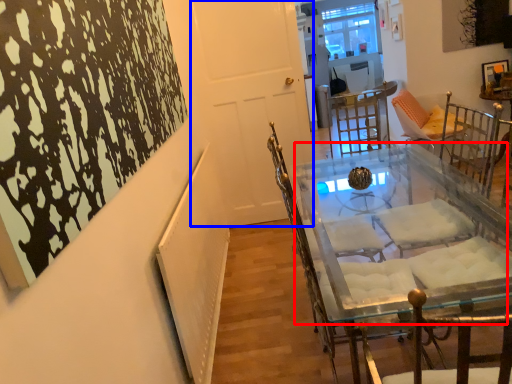
Question: Which object appears farthest to the camera in this image, round table (highlighted by a red box) or door (highlighted by a blue box)?

Choices:
 (A) round table
 (B) door

Answer: (B)